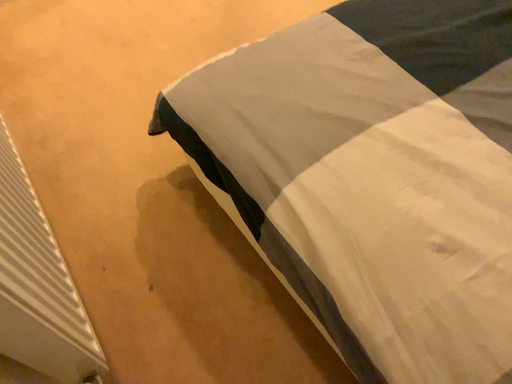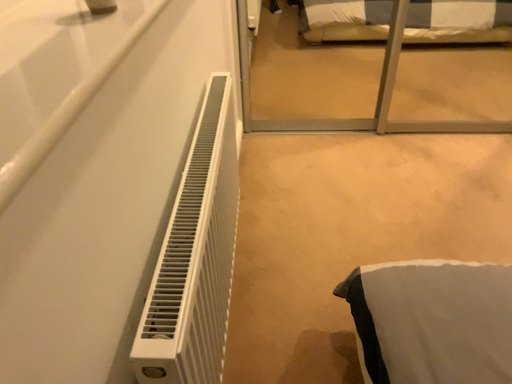
Question: Which way did the camera rotate in the video?

Choices:
 (A) rotated downward
 (B) rotated upward

Answer: (B)